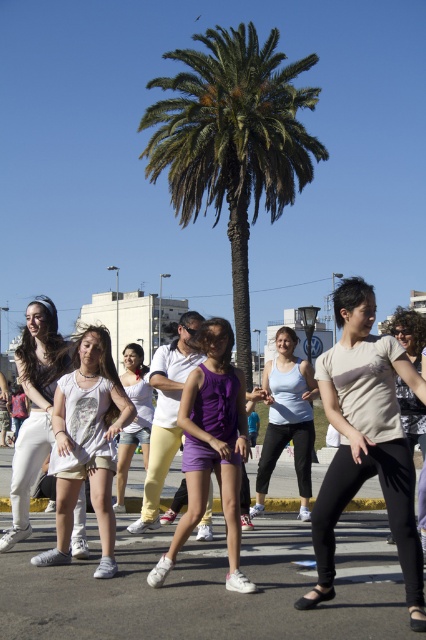
You are a photographer trying to capture a clear shot of the white matte pants at center and the white matte tank top at center. Which piece of clothing will appear larger in your photo?

The white matte pants at center will appear larger in the photo because it is closer to the viewer than the white matte tank top at center.

You are a photographer trying to capture the purple matte shorts at center in the scene. Based on their coordinates, where exactly should you aim your camera?

The purple matte shorts at center is located at point (212, 445), so aim your camera at those coordinates to capture it accurately.

You are a photographer trying to capture a clear photo of the matte beige shirt at center. The green leafy palm at center is blocking your view. Can you determine if the palm is too big to block the entire shirt?

The green leafy palm at center is larger in size than matte beige shirt at center, so yes, the palm is large enough to block the entire shirt.